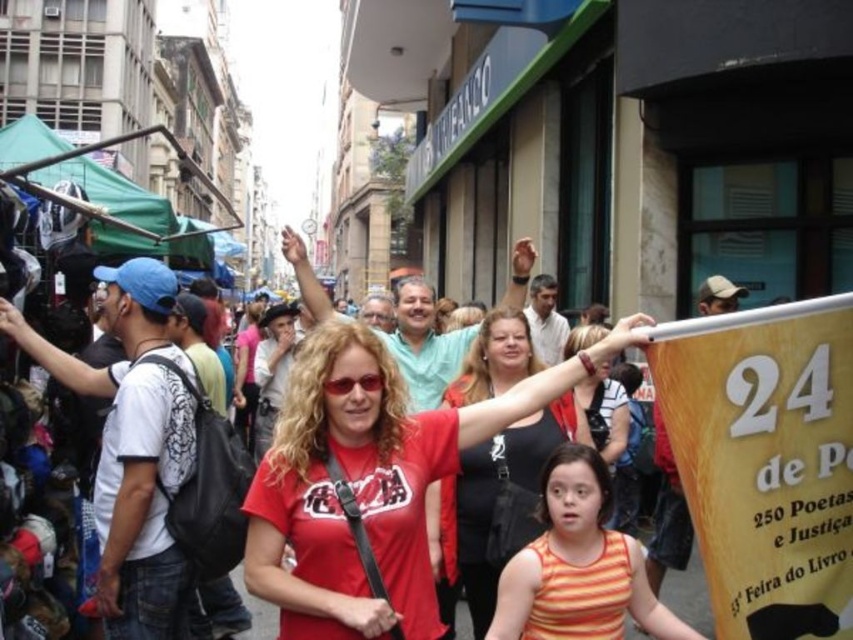
Is point (476, 592) positioned behind point (554, 557)?

Yes, point (476, 592) is farther from viewer.

Consider the image. Is the position of matte red shirt at center less distant than that of orange striped tank top at center?

No, it is behind orange striped tank top at center.

You are a GUI agent. You are given a task and a screenshot of the screen. Output one action in this format:
    pyautogui.click(x=<x>, y=<y>)
    Task: Click on the matte red shirt at center
    
    Given the screenshot: What is the action you would take?
    pyautogui.click(x=497, y=502)

Can you confirm if matte red t-shirt at center is shorter than matte red shirt at center?

Indeed, matte red t-shirt at center has a lesser height compared to matte red shirt at center.

Can you confirm if matte red t-shirt at center is wider than matte red shirt at center?

Indeed, matte red t-shirt at center has a greater width compared to matte red shirt at center.

Does point (378, 419) come behind point (495, 467)?

No.

This screenshot has width=853, height=640. Find the location of `matte red t-shirt at center`. matte red t-shirt at center is located at coordinates (369, 483).

Is matte red t-shirt at center to the right of orange striped tank top at center from the viewer's perspective?

In fact, matte red t-shirt at center is to the left of orange striped tank top at center.

Does point (287, 461) come behind point (601, 548)?

No, it is in front of (601, 548).

Where is `matte red t-shirt at center`? matte red t-shirt at center is located at coordinates (369, 483).